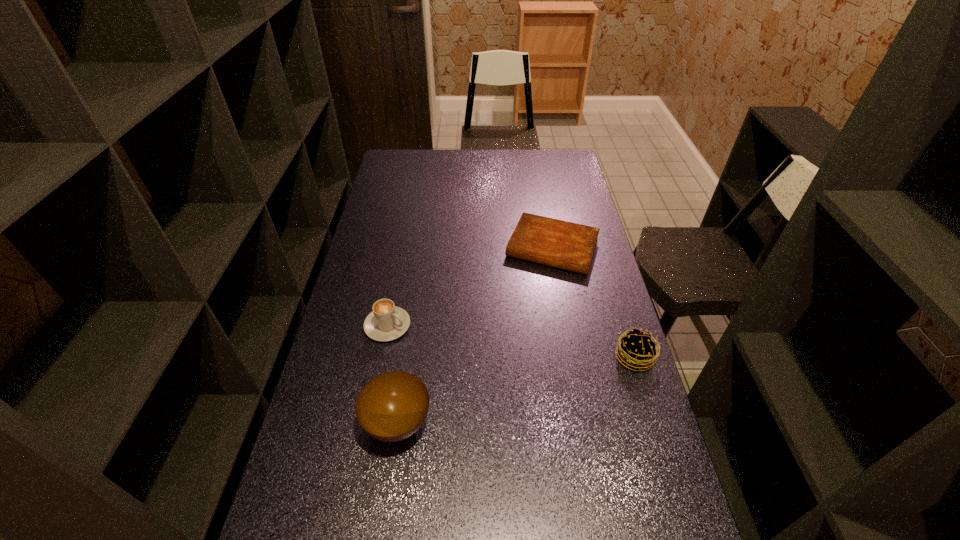
At what (x,y) coordinates should I click in order to perform the action: click on vacant space located to the right of the cappuccino. Please return your answer as a coordinate pair (x, y). The height and width of the screenshot is (540, 960). Looking at the image, I should click on (463, 364).

You are a GUI agent. You are given a task and a screenshot of the screen. Output one action in this format:
    pyautogui.click(x=<x>, y=<y>)
    Task: Click on the vacant space located to the right of the cappuccino
    
    Given the screenshot: What is the action you would take?
    pyautogui.click(x=445, y=356)

Identify the location of free space located to the right of the cappuccino. (421, 343).

This screenshot has width=960, height=540. What are the coordinates of `bowl at the left edge` in the screenshot? It's located at (391, 407).

You are a GUI agent. You are given a task and a screenshot of the screen. Output one action in this format:
    pyautogui.click(x=<x>, y=<y>)
    Task: Click on the cappuccino located in the left edge section of the desktop
    
    Given the screenshot: What is the action you would take?
    pyautogui.click(x=386, y=322)

Find the location of `patty that is at the right edge`. patty that is at the right edge is located at coordinates (637, 349).

Where is `Bible located at the right edge`? The width and height of the screenshot is (960, 540). Bible located at the right edge is located at coordinates (570, 246).

Identify the location of vacant space at the far edge of the desktop. (467, 150).

Identify the location of free space at the left edge of the desktop. This screenshot has width=960, height=540. (384, 258).

This screenshot has width=960, height=540. In the image, there is a desktop. Identify the location of free space at the right edge. (646, 400).